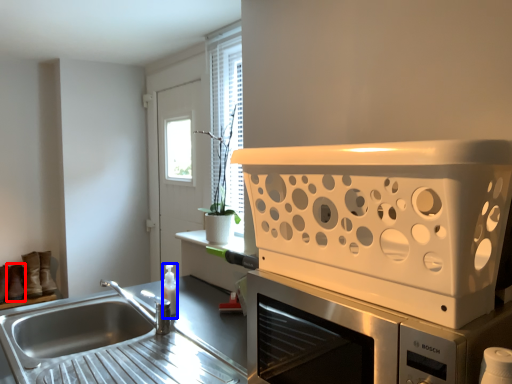
Question: Which object is further to the camera taking this photo, shoe (highlighted by a red box) or bottle (highlighted by a blue box)?

Choices:
 (A) shoe
 (B) bottle

Answer: (A)